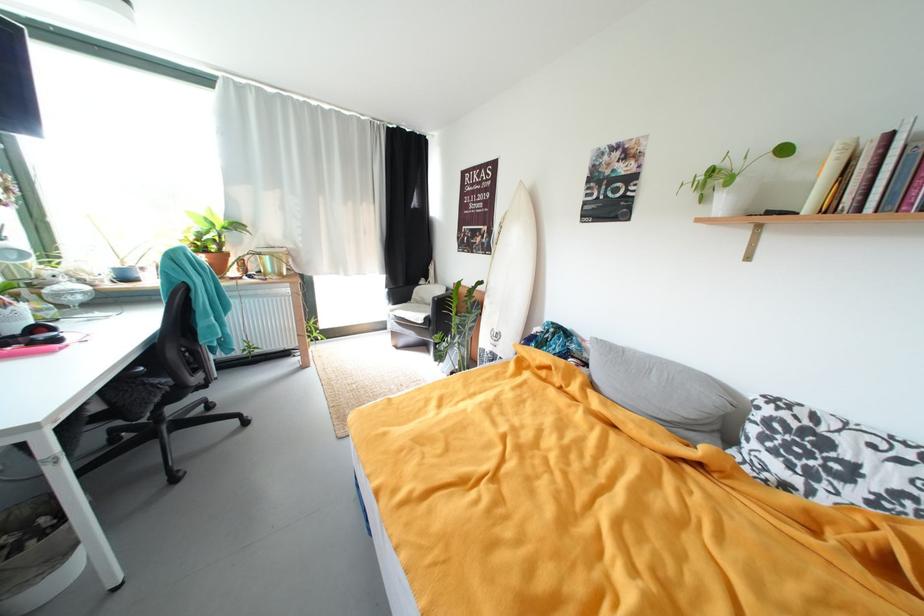
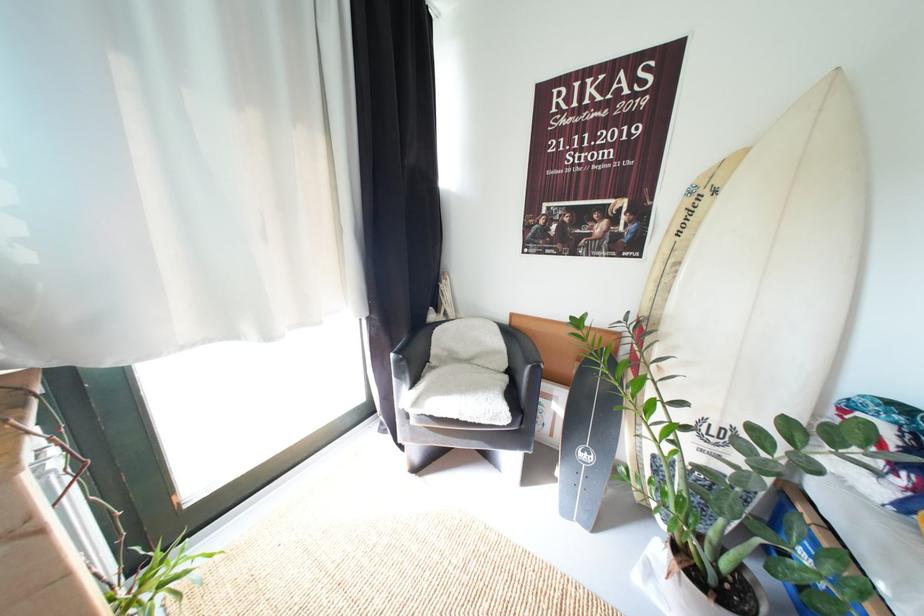
What movement of the cameraman would produce the second image?

The movement direction of the cameraman is left, forward.